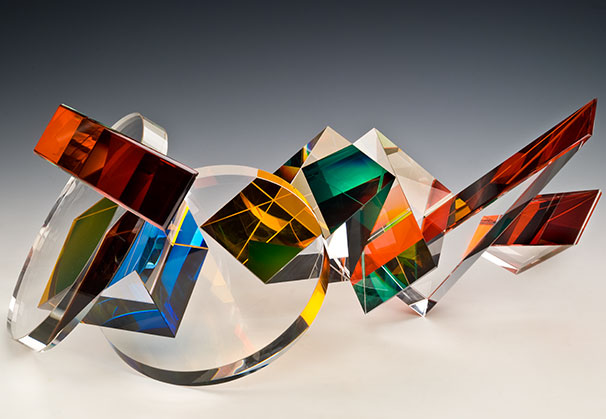
I want to click on glass objects, so click(x=73, y=273), click(x=155, y=322), click(x=140, y=263), click(x=134, y=186), click(x=322, y=188), click(x=390, y=233), click(x=468, y=199), click(x=551, y=230).